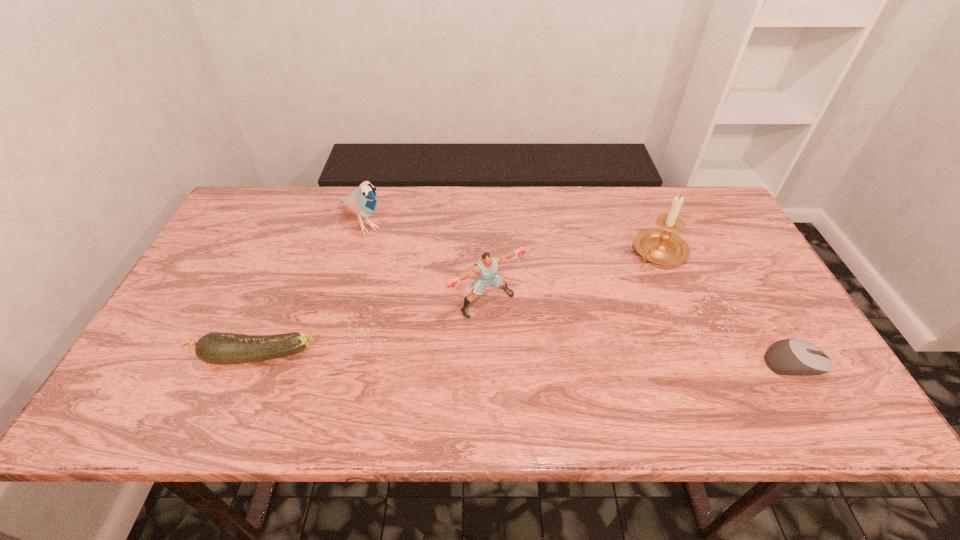
Where is `vacant spot on the desktop that is between the zucchini and the rightmost object and is positioned with a handle on the side of the candle holder`? Image resolution: width=960 pixels, height=540 pixels. vacant spot on the desktop that is between the zucchini and the rightmost object and is positioned with a handle on the side of the candle holder is located at coordinates pos(552,361).

Where is `free space on the desktop that is between the zucchini and the rightmost object and is positioned at the face of the bird`? free space on the desktop that is between the zucchini and the rightmost object and is positioned at the face of the bird is located at coordinates (496, 360).

What are the coordinates of `vacant spot on the desktop that is between the zucchini and the computer equipment and is positioned on the front-facing side of the puncher` in the screenshot? It's located at (537, 360).